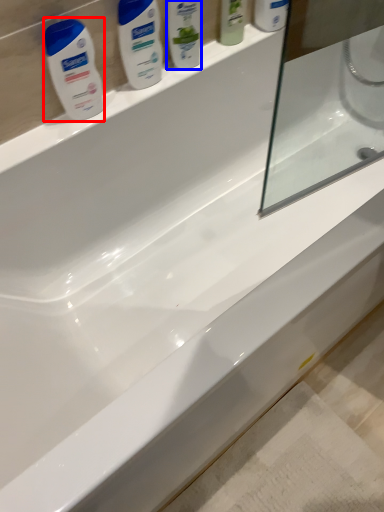
Question: Which object appears farthest to the camera in this image, cleaning product (highlighted by a red box) or cleaning product (highlighted by a blue box)?

Choices:
 (A) cleaning product
 (B) cleaning product

Answer: (B)